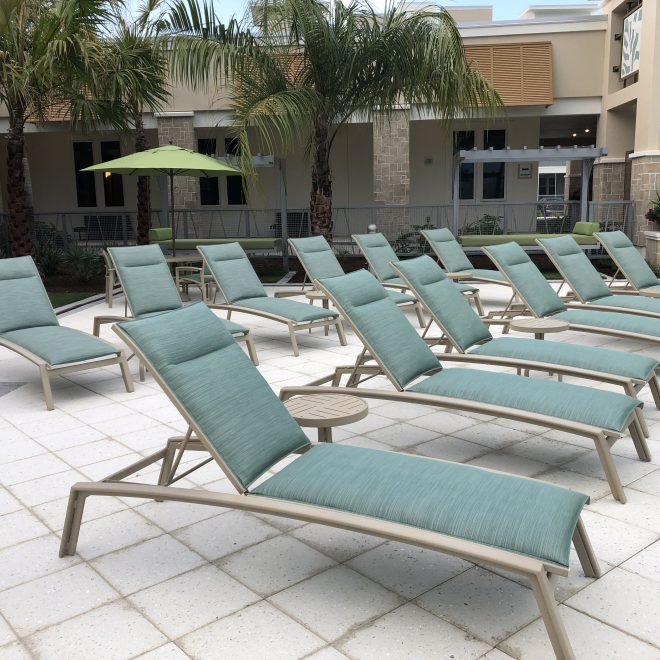
This screenshot has width=660, height=660. In order to click on floor in this screenshot , I will do `click(338, 598)`.